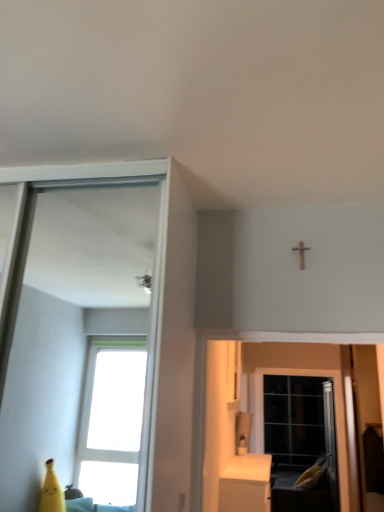
Question: Is black glass screen door at lower right bigger than white glossy cabinet at lower right?

Choices:
 (A) yes
 (B) no

Answer: (B)

Question: Does black glass screen door at lower right have a greater height compared to white glossy cabinet at lower right?

Choices:
 (A) yes
 (B) no

Answer: (A)

Question: Is white glossy cabinet at lower right located within black glass screen door at lower right?

Choices:
 (A) no
 (B) yes

Answer: (A)

Question: From a real-world perspective, does black glass screen door at lower right stand above white glossy cabinet at lower right?

Choices:
 (A) yes
 (B) no

Answer: (A)

Question: Is black glass screen door at lower right next to white glossy cabinet at lower right?

Choices:
 (A) no
 (B) yes

Answer: (A)

Question: Is black glass screen door at lower right thinner than white glossy cabinet at lower right?

Choices:
 (A) yes
 (B) no

Answer: (A)

Question: Can you confirm if white glossy cabinet at lower right is smaller than black glass screen door at lower right?

Choices:
 (A) no
 (B) yes

Answer: (A)

Question: From a real-world perspective, is white glossy cabinet at lower right physically below black glass screen door at lower right?

Choices:
 (A) no
 (B) yes

Answer: (B)

Question: Is white glossy cabinet at lower right turned away from black glass screen door at lower right?

Choices:
 (A) yes
 (B) no

Answer: (B)

Question: From a real-world perspective, is white glossy cabinet at lower right located higher than black glass screen door at lower right?

Choices:
 (A) yes
 (B) no

Answer: (B)

Question: Is white glossy cabinet at lower right located outside black glass screen door at lower right?

Choices:
 (A) yes
 (B) no

Answer: (A)

Question: Is white glossy cabinet at lower right shorter than black glass screen door at lower right?

Choices:
 (A) yes
 (B) no

Answer: (A)

Question: Is black glass screen door at lower right wider or thinner than white glossy cabinet at lower right?

Choices:
 (A) wide
 (B) thin

Answer: (B)